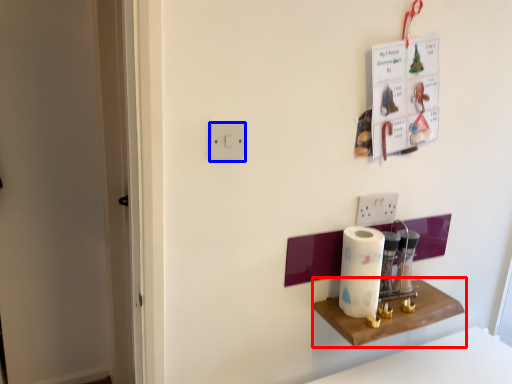
Question: Which object is further to the camera taking this photo, shelf (highlighted by a red box) or light switch (highlighted by a blue box)?

Choices:
 (A) shelf
 (B) light switch

Answer: (A)